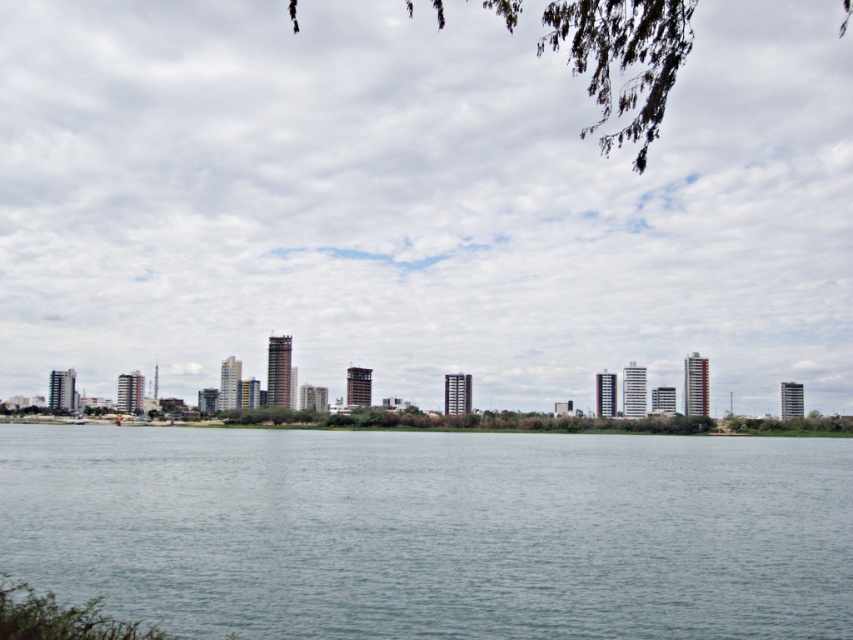
Which is more to the left, transparent glass skyline at center or gray water at center?

From the viewer's perspective, gray water at center appears more on the left side.

Does transparent glass skyline at center appear under gray water at center?

No.

Between point (413, 298) and point (527, 628), which one is positioned behind?

The point (413, 298) is more distant.

I want to click on transparent glass skyline at center, so click(418, 202).